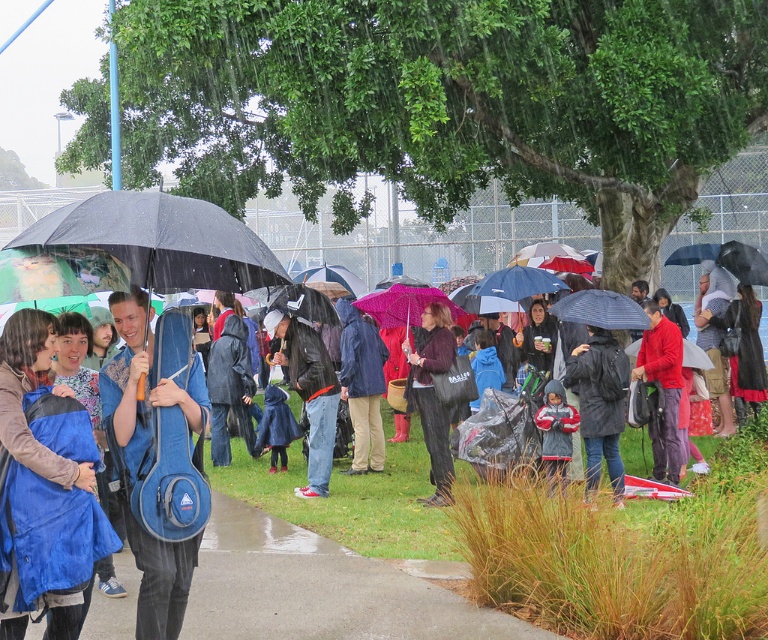
Looking at this image, is dark gray matte jacket at center bigger than velvet purple sweater at center?

No, dark gray matte jacket at center is not bigger than velvet purple sweater at center.

Is dark gray matte jacket at center below velvet purple sweater at center?

Indeed, dark gray matte jacket at center is positioned under velvet purple sweater at center.

At what (x,y) coordinates should I click in order to perform the action: click on dark gray matte jacket at center. Please return your answer as a coordinate pair (x, y). The width and height of the screenshot is (768, 640). Looking at the image, I should click on (601, 406).

Is blue fabric bag at center smaller than velvet purple sweater at center?

Correct, blue fabric bag at center occupies less space than velvet purple sweater at center.

Is blue fabric bag at center below velvet purple sweater at center?

Indeed, blue fabric bag at center is positioned under velvet purple sweater at center.

Which is in front, point (38, 420) or point (404, 342)?

Point (38, 420) is in front.

This screenshot has height=640, width=768. I want to click on blue fabric bag at center, so (x=45, y=490).

Describe the element at coordinates (310, 392) in the screenshot. I see `denim jacket at center` at that location.

Can you confirm if denim jacket at center is taller than dark blue fabric jacket at center?

Incorrect, denim jacket at center's height is not larger of dark blue fabric jacket at center's.

Does point (300, 349) come in front of point (379, 397)?

Yes, it is in front of point (379, 397).

The width and height of the screenshot is (768, 640). Identify the location of denim jacket at center. (310, 392).